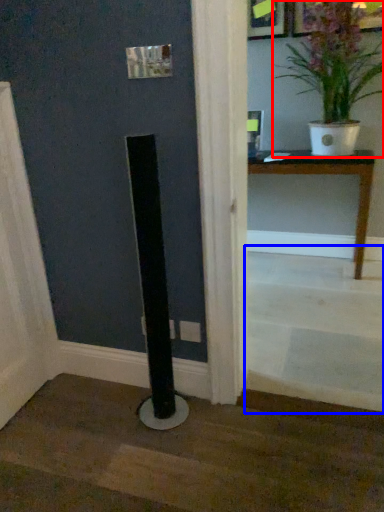
Question: Which object is closer to the camera taking this photo, houseplant (highlighted by a red box) or stairwell (highlighted by a blue box)?

Choices:
 (A) houseplant
 (B) stairwell

Answer: (B)